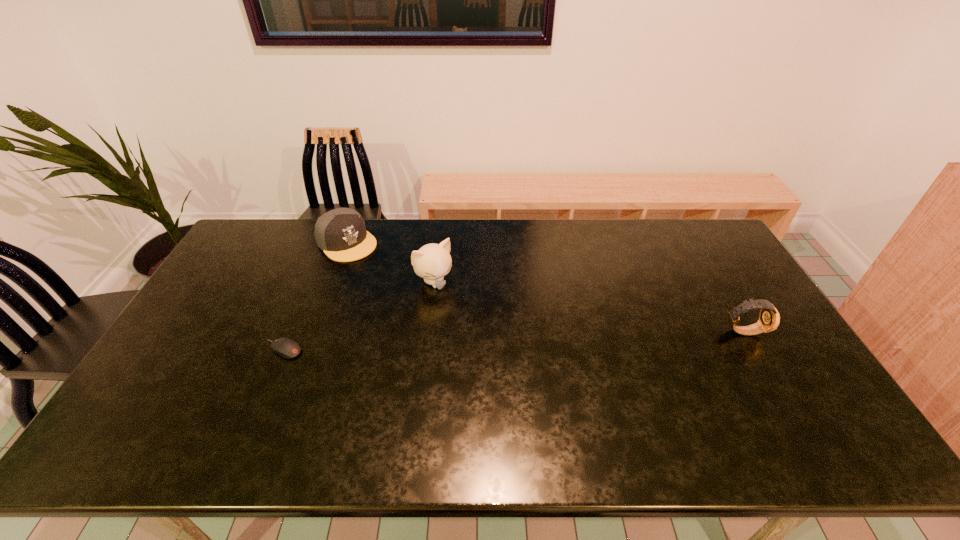
Identify the location of free spot at the far right corner of the desktop. (688, 232).

What are the coordinates of `vacant space that's between the third object from left to right and the shortest object` in the screenshot? It's located at (358, 316).

Identify the location of free spot between the rightmost object and the computer mouse. The height and width of the screenshot is (540, 960). (513, 340).

The width and height of the screenshot is (960, 540). I want to click on free space between the third nearest object and the farthest object, so click(391, 262).

Image resolution: width=960 pixels, height=540 pixels. I want to click on vacant space that's between the second farthest object and the cap, so click(x=391, y=262).

This screenshot has width=960, height=540. Find the location of `unoccupied position between the cap and the tallest object`. unoccupied position between the cap and the tallest object is located at coordinates (391, 262).

This screenshot has width=960, height=540. Find the location of `vacant space that is in between the rightmost object and the shortest object`. vacant space that is in between the rightmost object and the shortest object is located at coordinates (513, 340).

Identify the location of vacant area that lies between the watch and the shortest object. Image resolution: width=960 pixels, height=540 pixels. (513, 340).

Locate an element on the screen. vacant area between the cap and the computer mouse is located at coordinates (x=315, y=296).

Where is `empty space between the cap and the second object from right to left`? empty space between the cap and the second object from right to left is located at coordinates (391, 262).